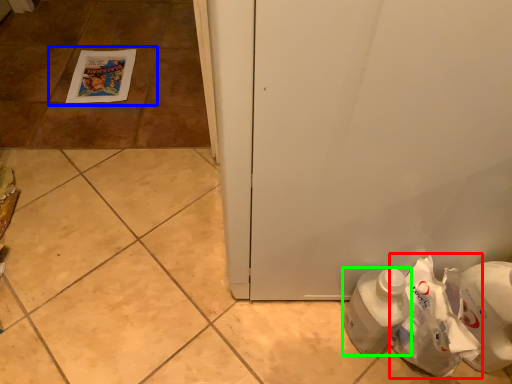
Question: Which is farther away from paper bag (highlighted by a red box)? tile (highlighted by a blue box) or bottle (highlighted by a green box)?

Choices:
 (A) tile
 (B) bottle

Answer: (A)